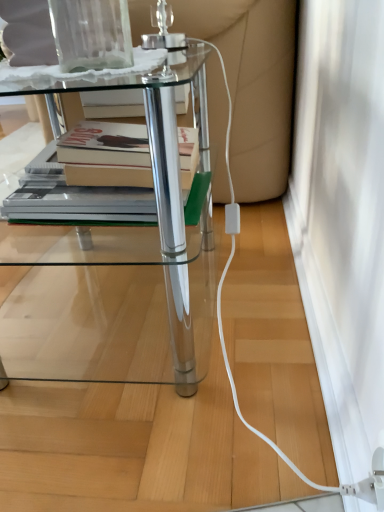
At what (x,y) coordinates should I click in order to perform the action: click on free location to the left of white matte screen door at lower right. Please return your answer as a coordinate pair (x, y). Looking at the image, I should click on (149, 316).